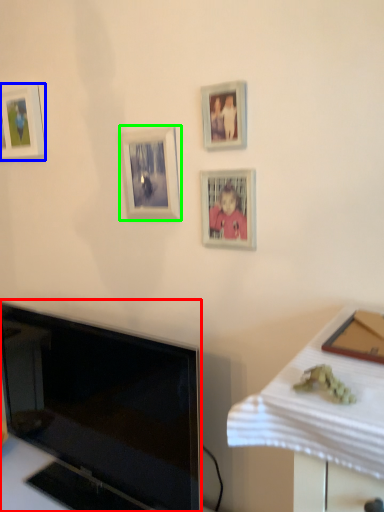
Question: Based on their relative distances, which object is nearer to television (highlighted by a red box)? Choose from picture frame (highlighted by a blue box) and picture frame (highlighted by a green box).

Choices:
 (A) picture frame
 (B) picture frame

Answer: (B)